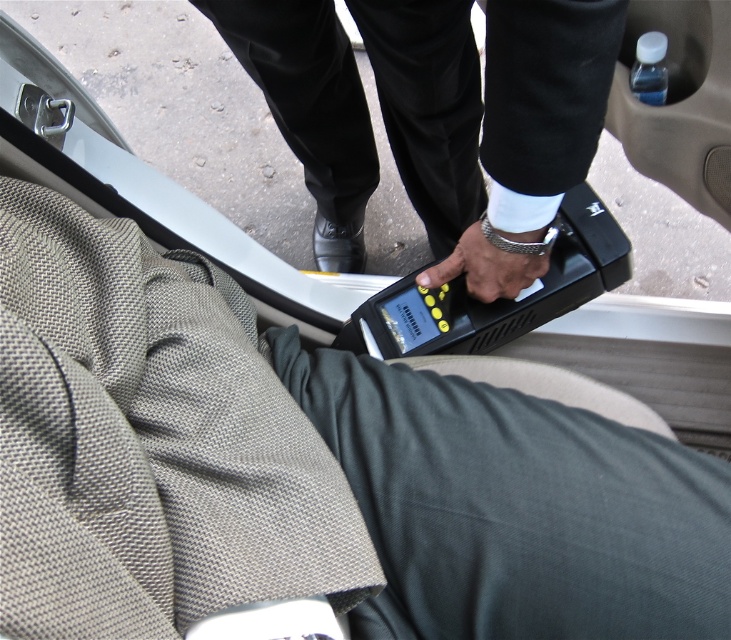
You are a technician working on a car. You need to place both the black plastic remote at center and the satin silver wristwatch at center into a tool pouch that can only hold items within a 12 inch diameter. Can both items fit inside the pouch without overlapping?

The black plastic remote at center and the satin silver wristwatch at center are 10.09 inches apart from each other. Since the tool pouch has a 12 inch diameter, which is larger than the distance between them, both items can fit inside the pouch without overlapping.

You are a technician inside a car and need to locate the black plastic remote at center. According to the coordinates provided, where exactly should you look?

The black plastic remote at center is located at point coordinates (491, 116).

You are a technician checking the dashboard of a car. You see a black plastic remote at center and a satin silver wristwatch at center. Which object is located higher in your field of view?

The black plastic remote at center is above the satin silver wristwatch at center, so the black plastic remote at center is higher in your field of view.